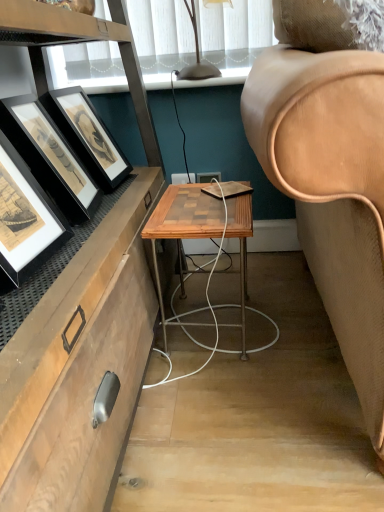
Question: Considering the positions of point (43, 204) and point (243, 340), is point (43, 204) closer or farther from the camera than point (243, 340)?

Choices:
 (A) closer
 (B) farther

Answer: (A)

Question: Is black matte picture frame at left, the second picture frame from the back, to the left or to the right of woodenmaterial/texturetable at center in the image?

Choices:
 (A) left
 (B) right

Answer: (A)

Question: Considering the real-world distances, which object is farthest from the matte black table lamp at upper center?

Choices:
 (A) black matte picture frame at left, the second picture frame from the back
 (B) black matte picture frame at left, the 2th picture frame from the front
 (C) woodenmaterial/texturetable at center

Answer: (A)

Question: Which of these objects is positioned farthest from the matte black table lamp at upper center?

Choices:
 (A) black matte picture frame at left, the 2th picture frame from the front
 (B) woodenmaterial/texturetable at center
 (C) black matte picture frame at left, acting as the first picture frame starting from the front

Answer: (C)